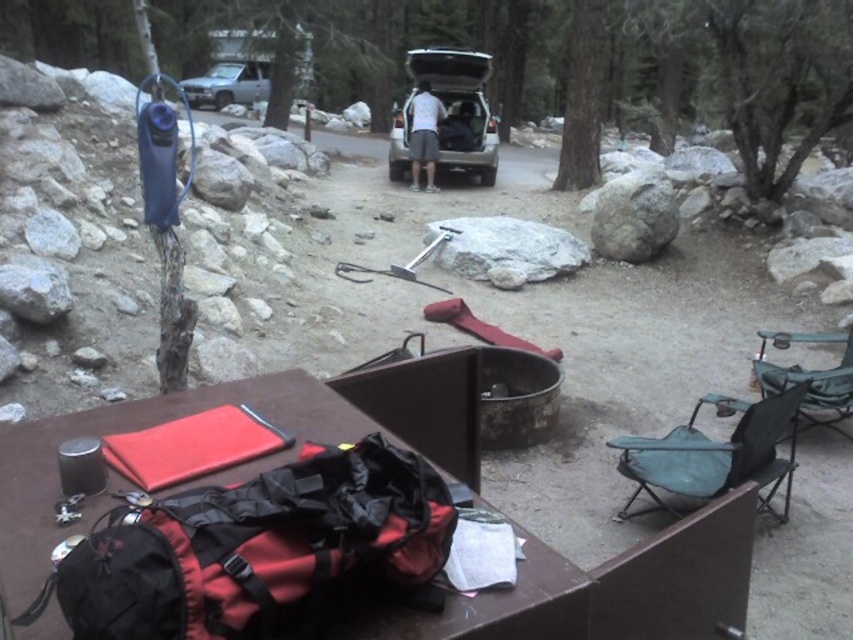
Can you confirm if rubberized red duffel bag at center is shorter than brushed metal truck at upper left?

Yes, rubberized red duffel bag at center is shorter than brushed metal truck at upper left.

From the picture: Can you confirm if rubberized red duffel bag at center is positioned to the right of brushed metal truck at upper left?

Indeed, rubberized red duffel bag at center is positioned on the right side of brushed metal truck at upper left.

Which is behind, point (36, 442) or point (231, 64)?

Positioned behind is point (231, 64).

Where is `rubberized red duffel bag at center`? rubberized red duffel bag at center is located at coordinates (137, 429).

Who is higher up, matte silver suv at center or brushed metal truck at upper left?

brushed metal truck at upper left is higher up.

Is matte silver suv at center further to the viewer compared to brushed metal truck at upper left?

No, matte silver suv at center is closer to the viewer.

Is point (392, 154) less distant than point (213, 83)?

That is True.

The width and height of the screenshot is (853, 640). In order to click on matte silver suv at center in this screenshot , I will do `click(460, 108)`.

Between green fabric chair at lower right and matte silver suv at center, which one has less height?

green fabric chair at lower right

Does green fabric chair at lower right have a greater width compared to matte silver suv at center?

In fact, green fabric chair at lower right might be narrower than matte silver suv at center.

Which is in front, point (781, 426) or point (476, 147)?

Positioned in front is point (781, 426).

Image resolution: width=853 pixels, height=640 pixels. Find the location of `green fabric chair at lower right`. green fabric chair at lower right is located at coordinates (715, 456).